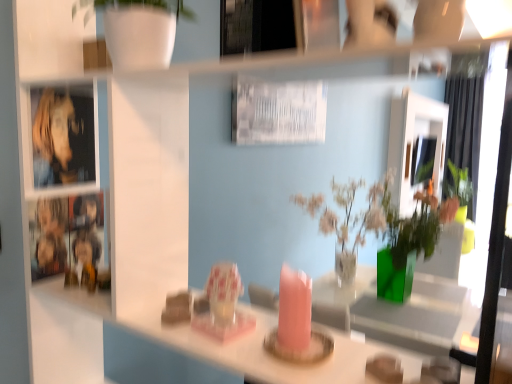
Question: Can you confirm if green fabric curtain at right is taller than matte white mirror at upper center?

Choices:
 (A) no
 (B) yes

Answer: (B)

Question: Considering the relative sizes of green fabric curtain at right and matte white mirror at upper center in the image provided, is green fabric curtain at right shorter than matte white mirror at upper center?

Choices:
 (A) yes
 (B) no

Answer: (B)

Question: Is green fabric curtain at right wider than matte white mirror at upper center?

Choices:
 (A) no
 (B) yes

Answer: (B)

Question: Is green fabric curtain at right turned away from matte white mirror at upper center?

Choices:
 (A) no
 (B) yes

Answer: (A)

Question: Is green fabric curtain at right oriented towards matte white mirror at upper center?

Choices:
 (A) yes
 (B) no

Answer: (A)

Question: Can you confirm if green fabric curtain at right is thinner than matte white mirror at upper center?

Choices:
 (A) no
 (B) yes

Answer: (A)

Question: From the image's perspective, is green fabric curtain at right on top of metallic reflective cabinet at left?

Choices:
 (A) no
 (B) yes

Answer: (B)

Question: Considering the relative sizes of green fabric curtain at right and metallic reflective cabinet at left in the image provided, is green fabric curtain at right shorter than metallic reflective cabinet at left?

Choices:
 (A) no
 (B) yes

Answer: (A)

Question: Is green fabric curtain at right in front of metallic reflective cabinet at left?

Choices:
 (A) no
 (B) yes

Answer: (A)

Question: Is metallic reflective cabinet at left completely or partially inside green fabric curtain at right?

Choices:
 (A) yes
 (B) no

Answer: (B)

Question: Is green fabric curtain at right further to the viewer compared to metallic reflective cabinet at left?

Choices:
 (A) yes
 (B) no

Answer: (A)

Question: Can you see green fabric curtain at right touching metallic reflective cabinet at left?

Choices:
 (A) no
 (B) yes

Answer: (A)

Question: Is matte white mirror at upper center positioned with its back to green fabric curtain at right?

Choices:
 (A) no
 (B) yes

Answer: (A)